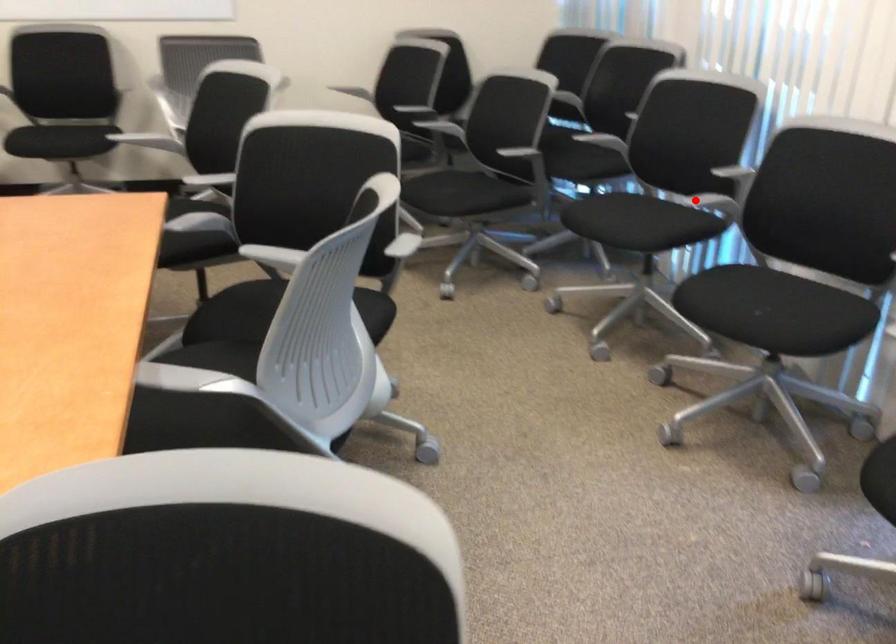
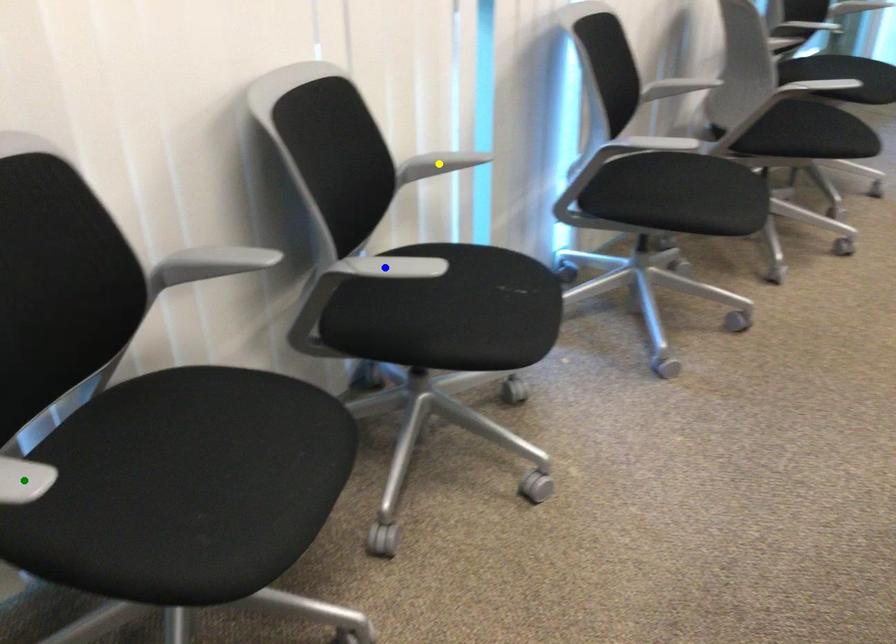
Question: I am providing you with two images of the same scene from different viewpoints. A red point is marked on the first image. You are given multiple points on the second image. Which point in image 2 represents the same 3d spot as the red point in image 1?

Choices:
 (A) green point
 (B) blue point
 (C) yellow point

Answer: (B)